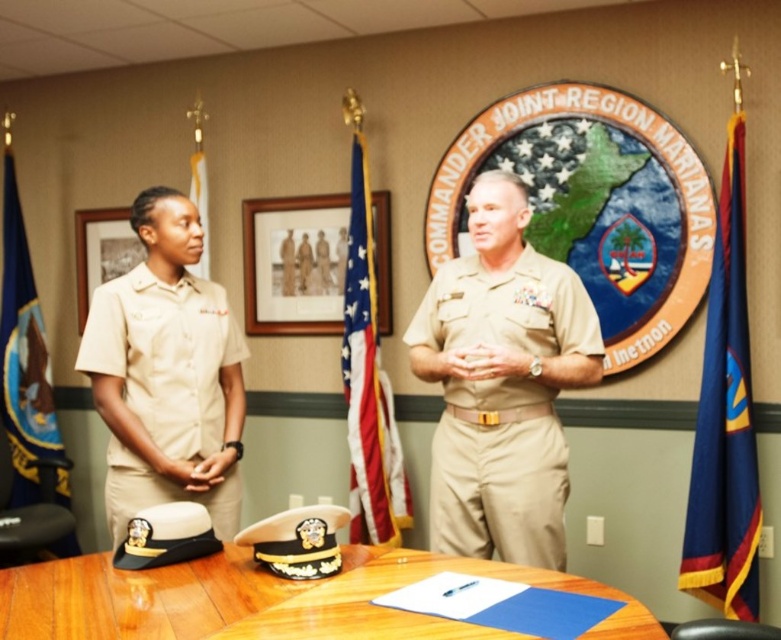
Looking at this image, you are a tailor measuring fabrics for a military uniform. You have a tan fabric uniform at center and a blue fabric flag at right. Which fabric has a larger width?

The tan fabric uniform at center has a larger width than the blue fabric flag at right.

You are a tailor measuring fabrics for alterations. You have a beige fabric uniform at left and a blue fabric flag at upper left. Which fabric item requires more fabric to alter? Explain your reasoning based on their sizes.

The beige fabric uniform at left requires more fabric for alterations because it has a larger size compared to the blue fabric flag at upper left.

You are a military assistant standing in the room. You need to report the position of the american flag at center relative to the blue fabric flag at upper left. What do you observe?

The american flag at center is to the right of blue fabric flag at upper left.